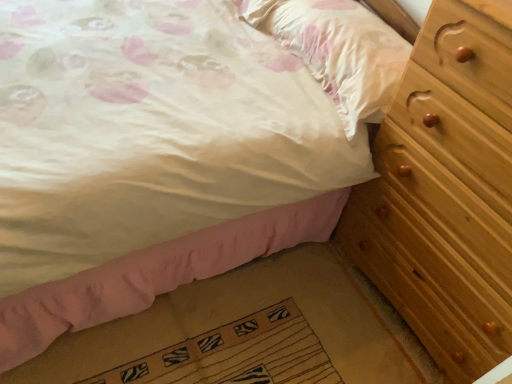
At what (x,y) coordinates should I click in order to perform the action: click on free space above wooden bed frame at lower right (from a real-world perspective). Please return your answer as a coordinate pair (x, y). Looking at the image, I should click on tap(221, 327).